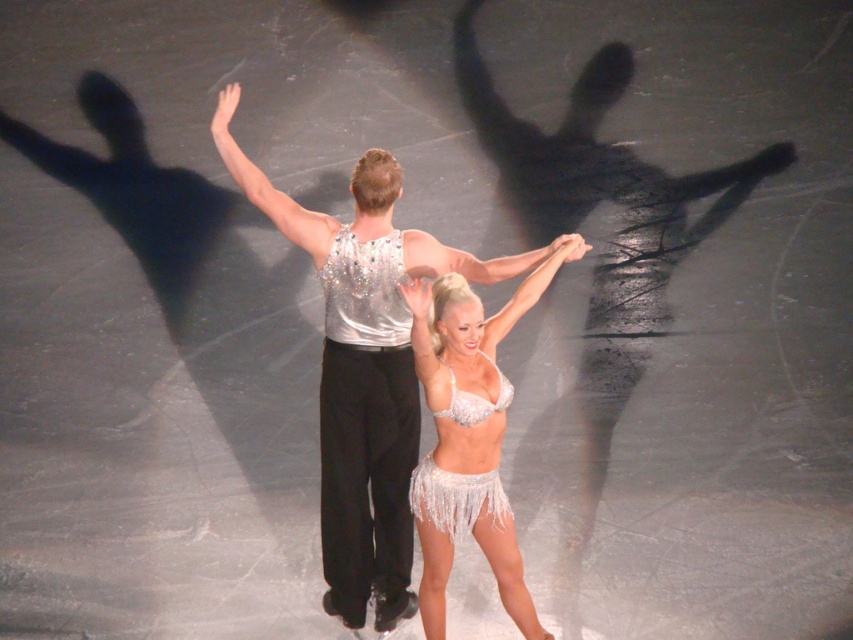
Question: Is sparkly silver bikini at center wider than white sequined skirt at center?

Choices:
 (A) no
 (B) yes

Answer: (B)

Question: Estimate the real-world distances between objects in this image. Which object is closer to the sparkly silver bikini at center?

Choices:
 (A) sequined white skirt at center
 (B) white sequined skirt at center

Answer: (A)

Question: Which of the following is the farthest from the observer?

Choices:
 (A) white sequined skirt at center
 (B) sparkly silver bikini at center
 (C) sequined white skirt at center
 (D) silver sparkly tank top at center

Answer: (A)

Question: Can you confirm if sparkly silver bikini at center is positioned above white sequined skirt at center?

Choices:
 (A) yes
 (B) no

Answer: (A)

Question: Estimate the real-world distances between objects in this image. Which object is farther from the white sequined skirt at center?

Choices:
 (A) sparkly silver bikini at center
 (B) sequined white skirt at center

Answer: (A)

Question: Does sequined white skirt at center appear on the left side of white sequined skirt at center?

Choices:
 (A) no
 (B) yes

Answer: (A)